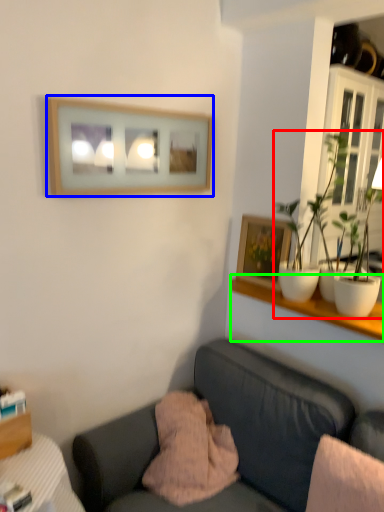
Question: Based on their relative distances, which object is nearer to houseplant (highlighted by a red box)? Choose from picture frame (highlighted by a blue box) and shelf (highlighted by a green box).

Choices:
 (A) picture frame
 (B) shelf

Answer: (B)